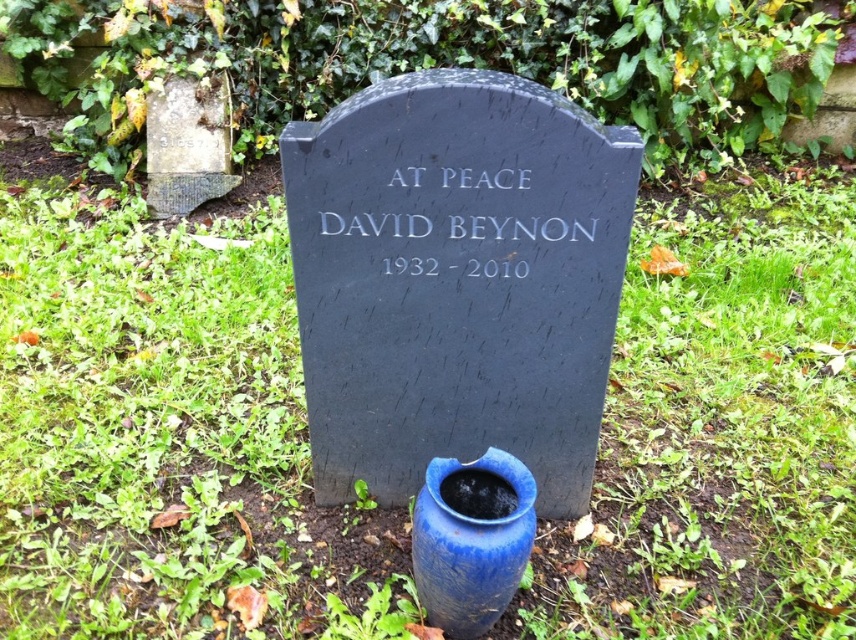
Question: Which object is the closest to the green grass at center?

Choices:
 (A) weathered stone gravestone at upper left
 (B) blue glazed vase at center

Answer: (B)

Question: Among these points, which one is farthest from the camera?

Choices:
 (A) click(471, 225)
 (B) click(447, 554)
 (C) click(203, 148)

Answer: (C)

Question: Is green grass at center below weathered stone gravestone at upper left?

Choices:
 (A) no
 (B) yes

Answer: (B)

Question: Can you confirm if green grass at center is positioned to the left of white metallic text at center?

Choices:
 (A) yes
 (B) no

Answer: (B)

Question: Which object is the closest to the white metallic text at center?

Choices:
 (A) blue glazed vase at center
 (B) green grass at center

Answer: (A)

Question: In this image, where is blue glazed vase at center located relative to weathered stone gravestone at upper left?

Choices:
 (A) right
 (B) left

Answer: (A)